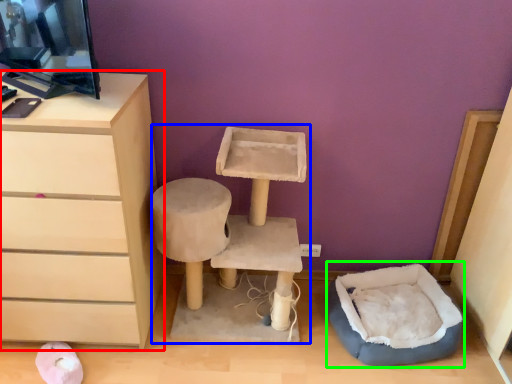
Question: Estimate the real-world distances between objects in this image. Which object is farther from chest of drawers (highlighted by a red box), vanity (highlighted by a blue box) or bean bag chair (highlighted by a green box)?

Choices:
 (A) vanity
 (B) bean bag chair

Answer: (B)